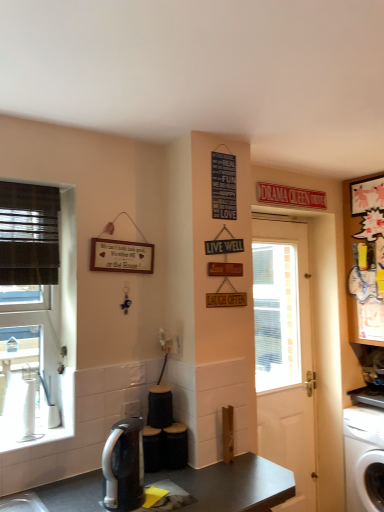
Question: Is point (281, 500) closer or farther from the camera than point (297, 365)?

Choices:
 (A) closer
 (B) farther

Answer: (A)

Question: From a real-world perspective, relative to white matte door at center, is dark gray laminate desk at center vertically above or below?

Choices:
 (A) below
 (B) above

Answer: (A)

Question: Which is nearer to the white plastic washing machine at lower right?

Choices:
 (A) cartoon paper cutout at upper right
 (B) dark gray laminate desk at center
 (C) white matte door at center
 (D) sleek silver coffee maker at lower center

Answer: (C)

Question: Which of these objects is positioned closest to the dark gray laminate desk at center?

Choices:
 (A) cartoon paper cutout at upper right
 (B) sleek silver coffee maker at lower center
 (C) white plastic washing machine at lower right
 (D) white matte door at center

Answer: (B)